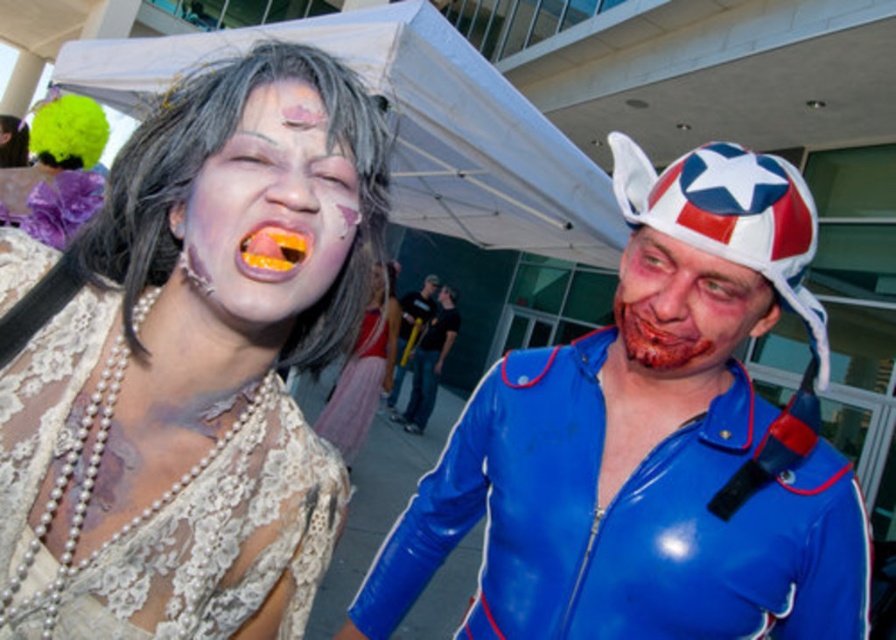
Question: Which of the following is the closest to the observer?

Choices:
 (A) (389, 298)
 (B) (733, 410)
 (C) (263, 234)
 (D) (672, 276)

Answer: (C)

Question: Can you confirm if pearl necklace at upper left is positioned to the right of matte blue helmet at right?

Choices:
 (A) no
 (B) yes

Answer: (A)

Question: Can you confirm if pearl necklace at center is positioned above rubberized blue suit at center?

Choices:
 (A) no
 (B) yes

Answer: (B)

Question: Estimate the real-world distances between objects in this image. Which object is farther from the matte white face at center?

Choices:
 (A) rubberized blue suit at center
 (B) gray lace wig at upper left

Answer: (A)

Question: Does pearl necklace at upper left appear over matte white face at center?

Choices:
 (A) yes
 (B) no

Answer: (B)

Question: Which of these objects is positioned closest to the pearl necklace at upper left?

Choices:
 (A) yellow glossy tongue at center
 (B) matte blue helmet at right

Answer: (A)